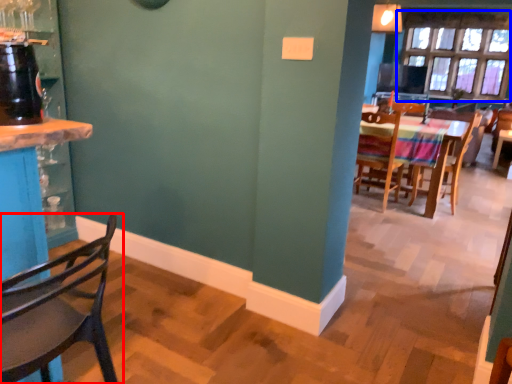
Question: Which point is further to the camera, chair (highlighted by a red box) or window (highlighted by a blue box)?

Choices:
 (A) chair
 (B) window

Answer: (B)